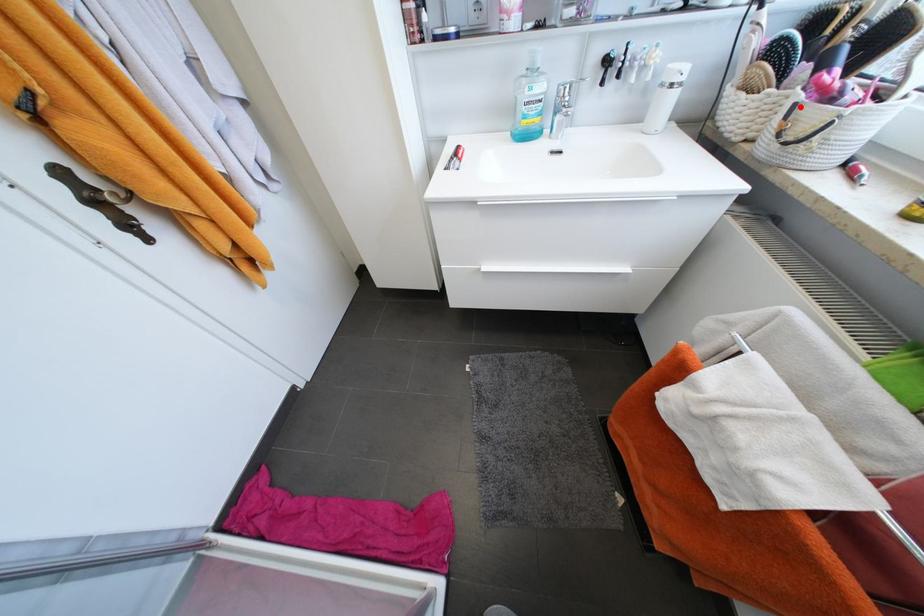
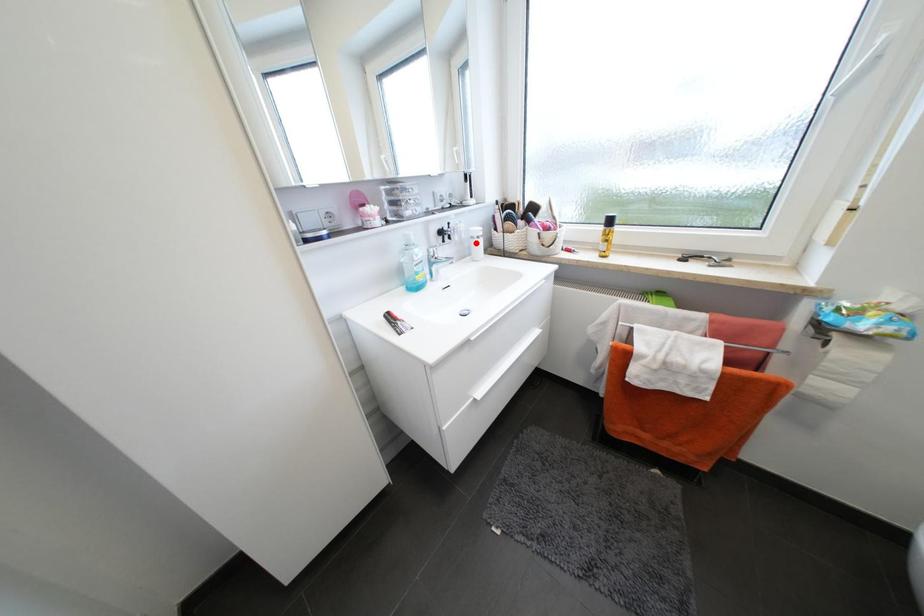
I am providing you with two images of the same scene from different viewpoints. A red point is marked on the first image and another point is marked on the second image. Are the points marked in image1 and image2 representing the same 3D position?

No